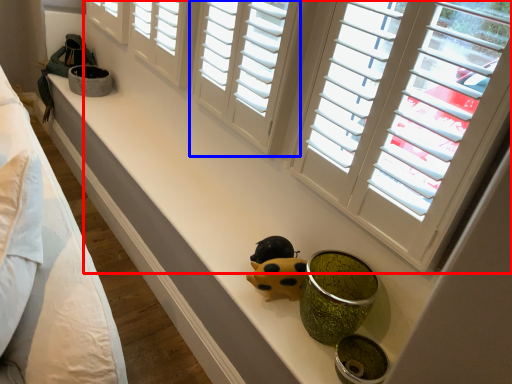
Question: Which object is further to the camera taking this photo, window (highlighted by a red box) or window (highlighted by a blue box)?

Choices:
 (A) window
 (B) window

Answer: (B)